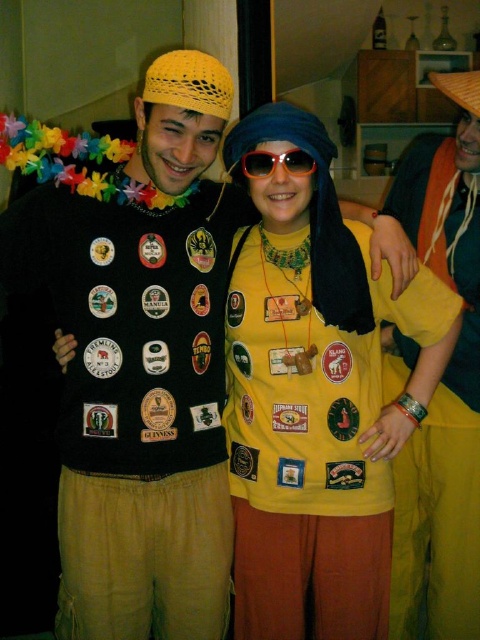
Based on the photo, does yellow knitted hat at upper center have a lesser height compared to wooden at upper right?

Indeed, yellow knitted hat at upper center has a lesser height compared to wooden at upper right.

This screenshot has height=640, width=480. What are the coordinates of `yellow knitted hat at upper center` in the screenshot? It's located at (190, 83).

Locate an element on the screen. This screenshot has height=640, width=480. yellow knitted hat at upper center is located at coordinates click(x=190, y=83).

Can you confirm if yellow fabric pants at right is shorter than yellow knitted hat at upper center?

In fact, yellow fabric pants at right may be taller than yellow knitted hat at upper center.

Between point (432, 580) and point (194, 51), which one is positioned behind?

The point (432, 580) is more distant.

This screenshot has height=640, width=480. What are the coordinates of `yellow fabric pants at right` in the screenshot? It's located at (441, 410).

Is yellow matte shirt at center positioned in front of yellow knitted hat at upper center?

No, yellow matte shirt at center is behind yellow knitted hat at upper center.

Locate an element on the screen. Image resolution: width=480 pixels, height=640 pixels. yellow matte shirt at center is located at coordinates (315, 396).

The height and width of the screenshot is (640, 480). Identify the location of yellow matte shirt at center. (315, 396).